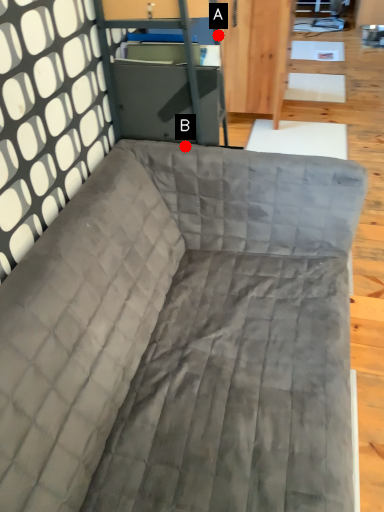
Question: Two points are circled on the image, labeled by A and B beside each circle. Which of the following is the farthest from the observer?

Choices:
 (A) A is further
 (B) B is further

Answer: (A)